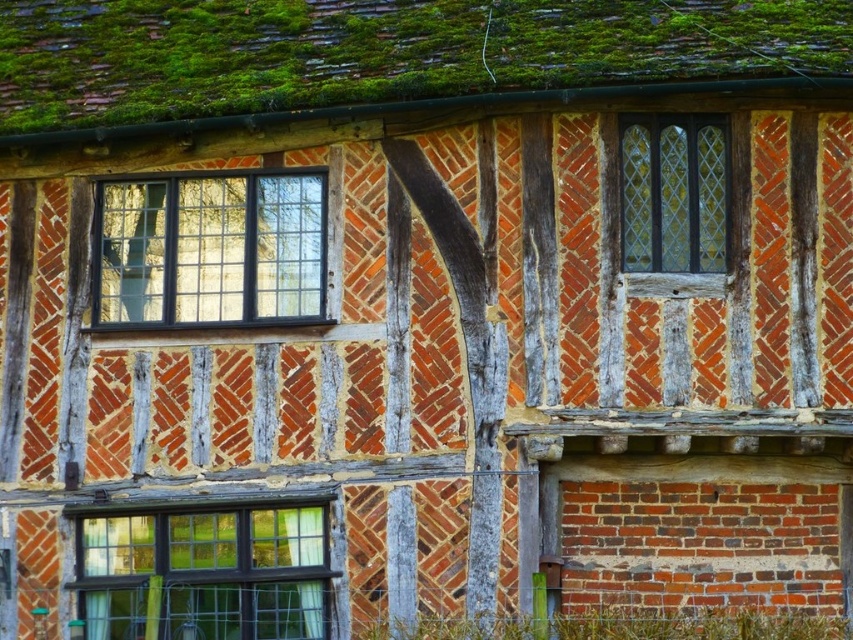
You are a construction worker inspecting the half timbered building. You need to reach the green mossy tiles at upper center to check for damage. What are the coordinates of the location you need to inspect?

The green mossy tiles at upper center are located at coordinates point (381, 54), so you should inspect that point.